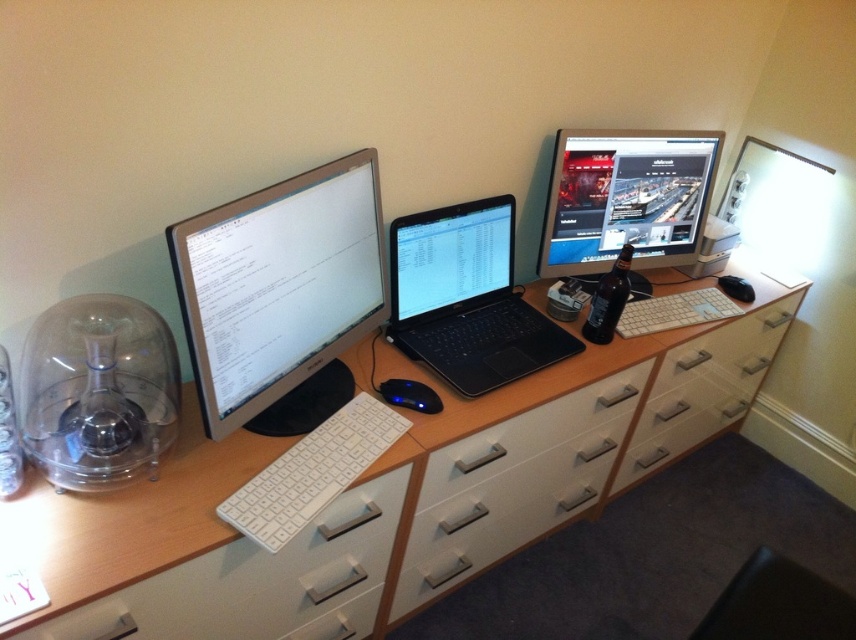
Question: Which of the following is the closest to the observer?

Choices:
 (A) satin black laptop at center
 (B) white plastic drawer at lower center
 (C) matte black monitor at upper right
 (D) black matte laptop at center

Answer: (B)

Question: In this image, where is white matte drawer at center located relative to satin black laptop at center?

Choices:
 (A) below
 (B) above

Answer: (A)

Question: Does satin black laptop at center have a greater width compared to black leather chair at lower right?

Choices:
 (A) yes
 (B) no

Answer: (B)

Question: Which of the following is the farthest from the observer?

Choices:
 (A) black matte laptop at center
 (B) white matte drawer at center

Answer: (A)

Question: Observing the image, what is the correct spatial positioning of white wood table at center in reference to satin black laptop at center?

Choices:
 (A) left
 (B) right

Answer: (B)

Question: Estimate the real-world distances between objects in this image. Which object is farther from the white plastic drawer at lower center?

Choices:
 (A) satin black monitor at left
 (B) matte black monitor at upper right
 (C) black matte laptop at center
 (D) white plastic drawer at center-right

Answer: (D)